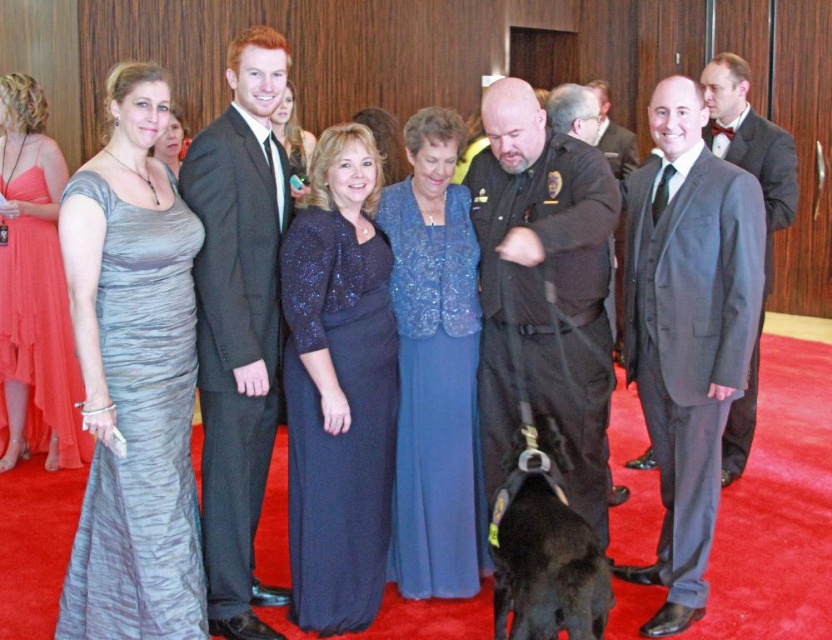
Does blue sequined dress at center have a smaller size compared to shiny blue dress at center?

Yes.

In the scene shown: Is blue sequined dress at center further to the viewer compared to shiny blue dress at center?

No.

Where is `blue sequined dress at center`? The image size is (832, 640). blue sequined dress at center is located at coordinates (434, 365).

What are the coordinates of `blue sequined dress at center` in the screenshot? It's located at (434, 365).

Can you confirm if blue sequined dress at center is bigger than shiny coral dress at left?

Actually, blue sequined dress at center might be smaller than shiny coral dress at left.

Is point (409, 346) farther from viewer compared to point (57, 184)?

No, it is not.

Measure the distance between blue sequined dress at center and camera.

A distance of 9.32 feet exists between blue sequined dress at center and camera.

Identify the location of blue sequined dress at center. (434, 365).

Who is shorter, sparkly dark blue dress at center or black leather dog at center?

black leather dog at center is shorter.

The width and height of the screenshot is (832, 640). In order to click on sparkly dark blue dress at center in this screenshot , I will do `click(338, 387)`.

Is point (382, 289) less distant than point (582, 612)?

No, it is behind (582, 612).

The height and width of the screenshot is (640, 832). Identify the location of sparkly dark blue dress at center. (338, 387).